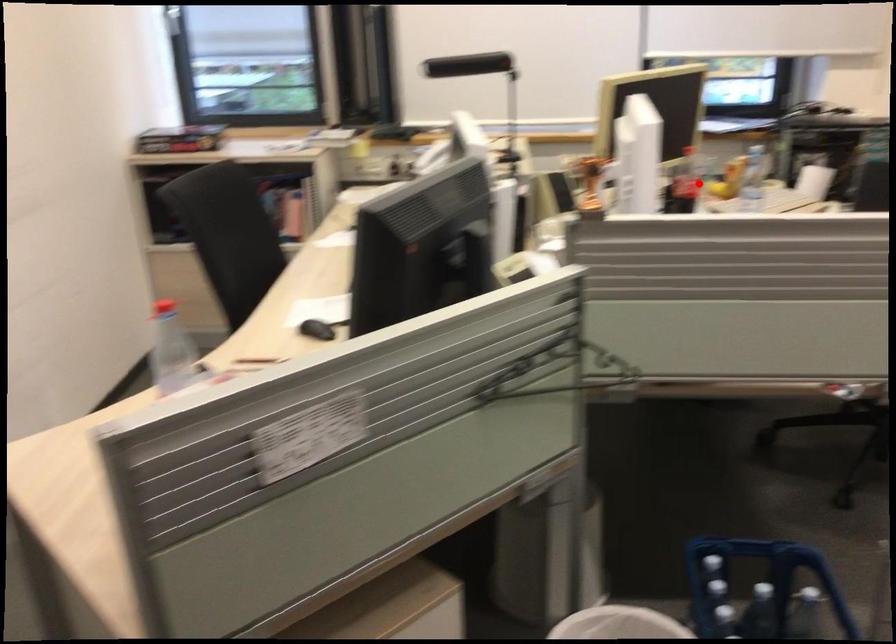
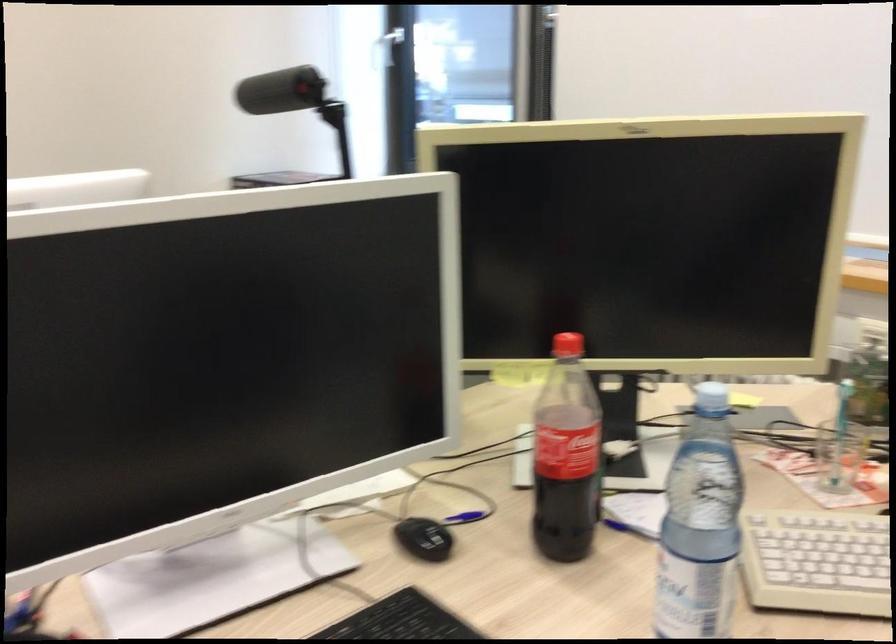
Where in the second image is the point corresponding to the highlighted location from the first image?

(839, 456)